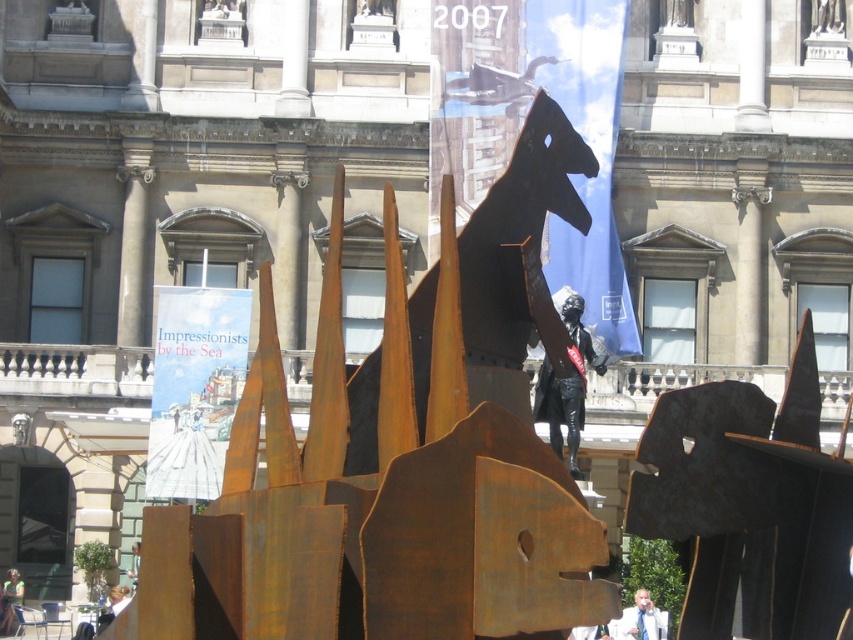
Is rusty metal sculpture at center above shiny black statue at center?

Incorrect, rusty metal sculpture at center is not positioned above shiny black statue at center.

Is point (828, 560) farther from camera compared to point (550, 369)?

No, it is not.

You are a GUI agent. You are given a task and a screenshot of the screen. Output one action in this format:
    pyautogui.click(x=<x>, y=<y>)
    Task: Click on the rusty metal sculpture at center
    This screenshot has height=640, width=853.
    Given the screenshot: What is the action you would take?
    pyautogui.click(x=750, y=502)

Which is more to the left, rusty metal sculpture at center or metallic gold statue at center?

From the viewer's perspective, metallic gold statue at center appears more on the left side.

Is rusty metal sculpture at center positioned behind metallic gold statue at center?

No.

Which is in front, point (758, 557) or point (126, 592)?

Point (758, 557) is in front.

Identify the location of rusty metal sculpture at center. The width and height of the screenshot is (853, 640). (750, 502).

Which is behind, point (577, 387) or point (125, 593)?

The point (125, 593) is behind.

Based on the photo, does shiny black statue at center have a lesser width compared to metallic gold statue at center?

No, shiny black statue at center is not thinner than metallic gold statue at center.

Which is in front, point (543, 388) or point (129, 589)?

Point (543, 388) is more forward.

This screenshot has width=853, height=640. Find the location of `shiny black statue at center`. shiny black statue at center is located at coordinates (560, 412).